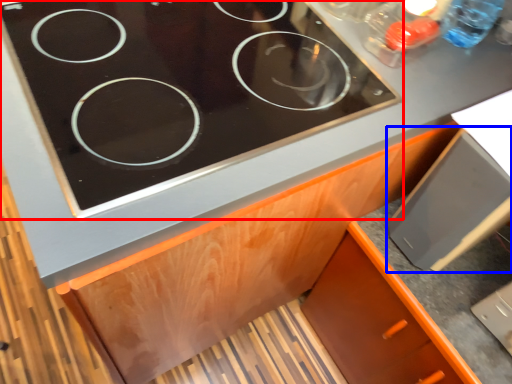
Question: Which object is closer to the camera taking this photo, gas stove (highlighted by a red box) or appliance (highlighted by a blue box)?

Choices:
 (A) gas stove
 (B) appliance

Answer: (A)